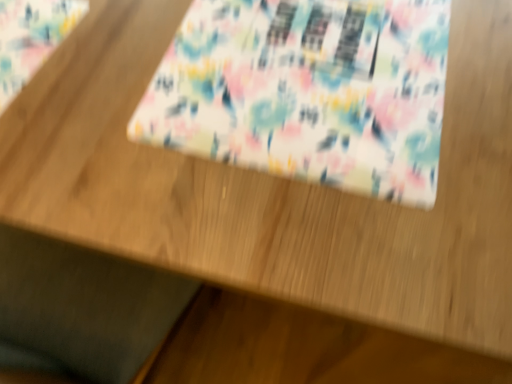
Locate an element on the screen. This screenshot has width=512, height=384. blank area beneath floral fabric blanket at center (from a real-world perspective) is located at coordinates (331, 52).